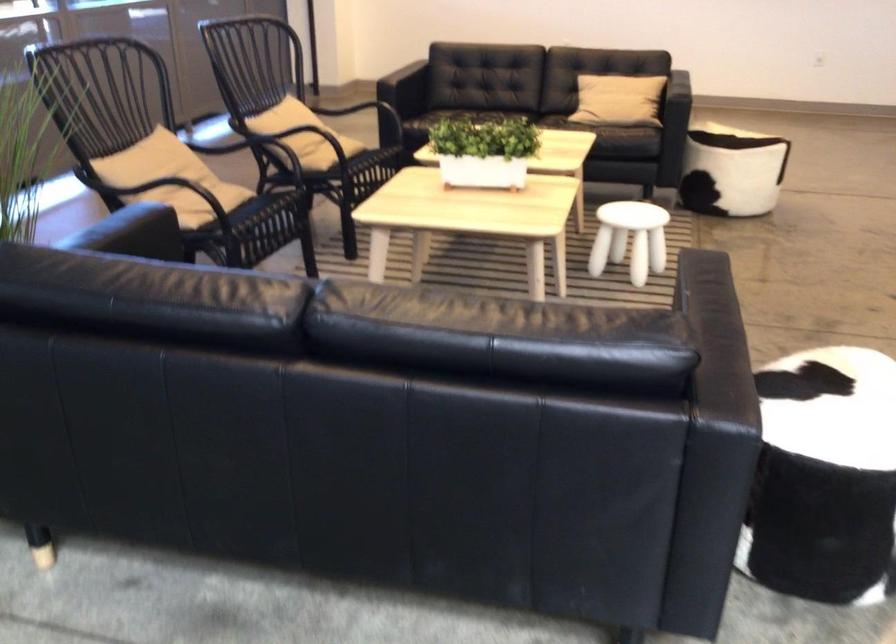
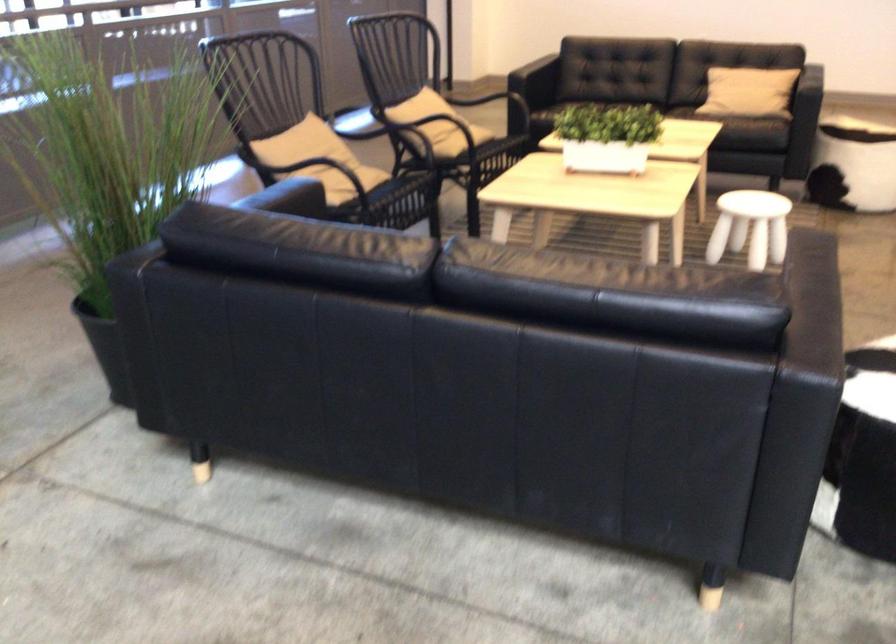
In the second image, find the point that corresponds to [612,128] in the first image.

(745, 120)